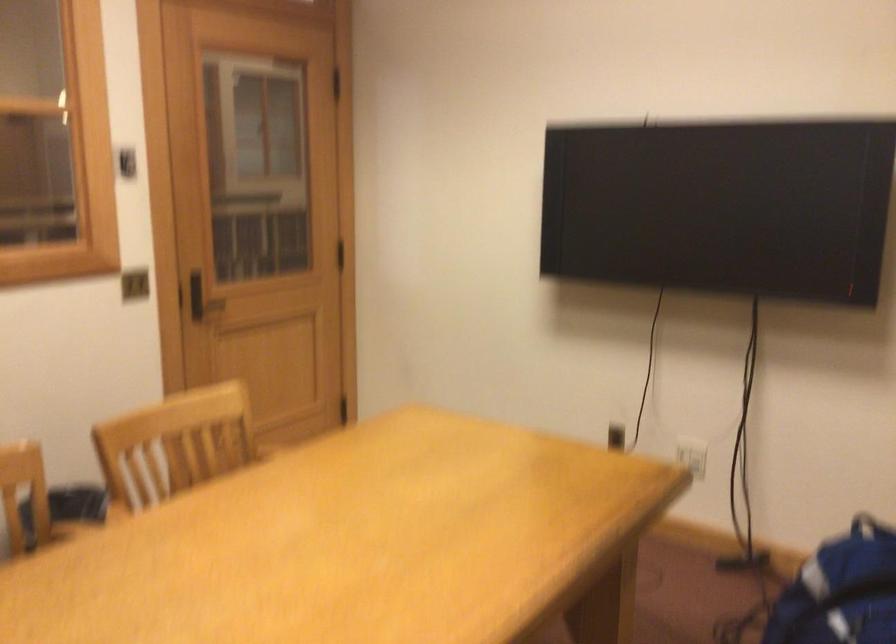
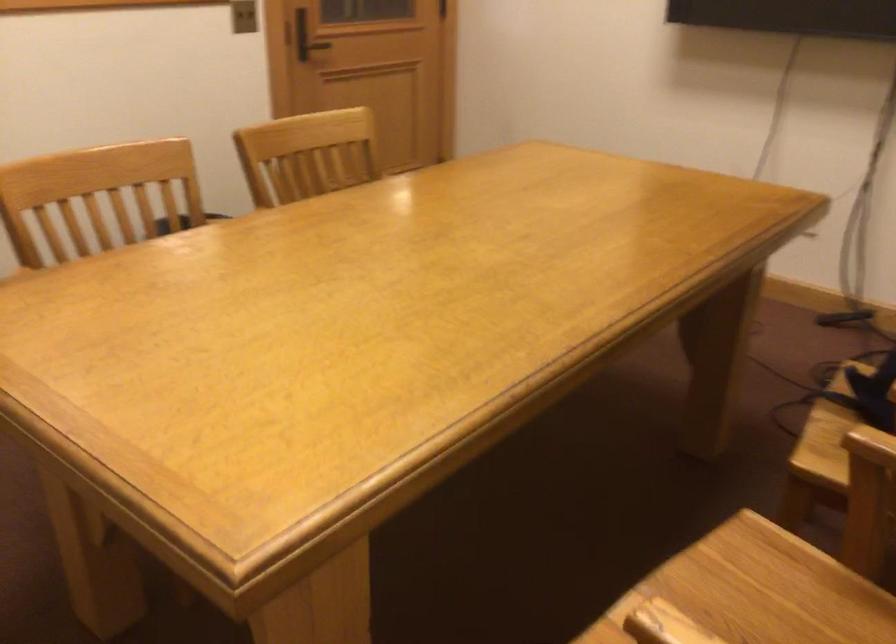
In the second image, find the point that corresponds to point 204,307 in the first image.

(308, 46)